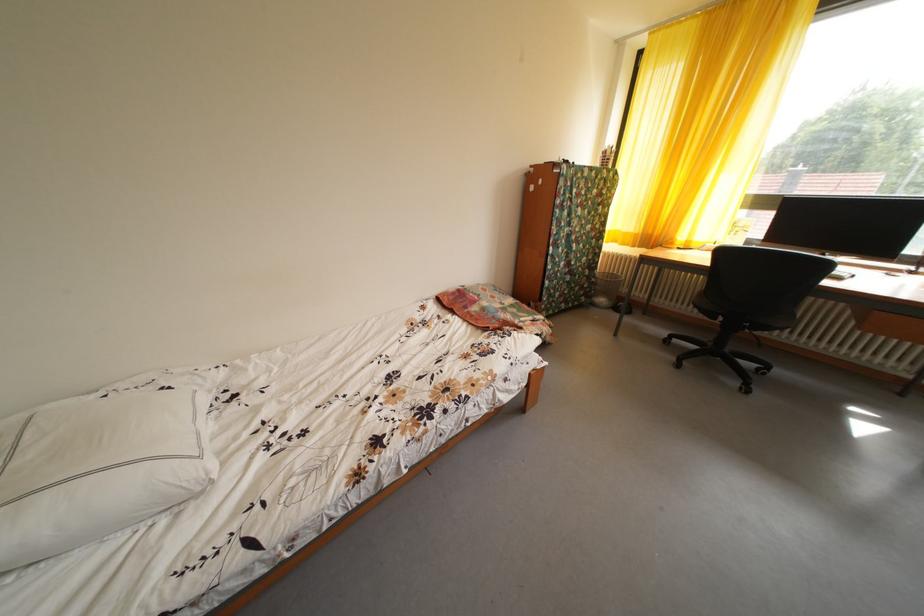
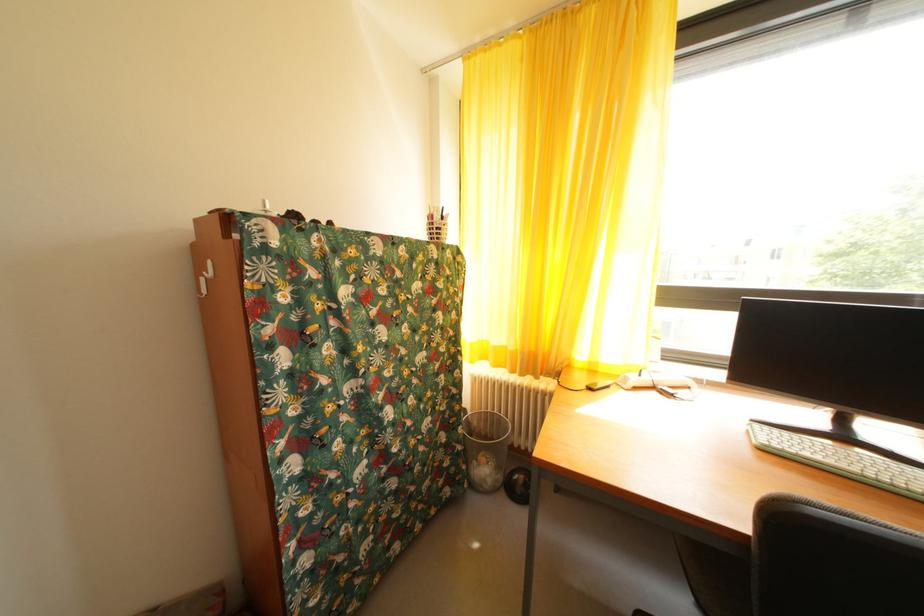
In the second image, find the point that corresponds to pixel 602 286 in the first image.

(468, 454)